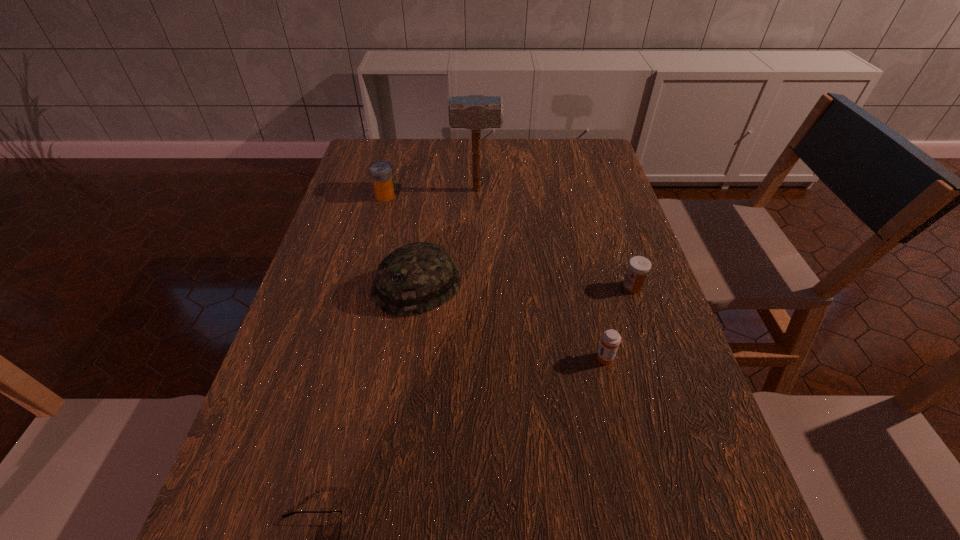
Identify the location of mallet. The width and height of the screenshot is (960, 540). (475, 112).

At what (x,y) coordinates should I click in order to perform the action: click on headwear. Please return your answer as a coordinate pair (x, y). This screenshot has height=540, width=960. Looking at the image, I should click on (417, 277).

The width and height of the screenshot is (960, 540). Find the location of `the leftmost medicine`. the leftmost medicine is located at coordinates (381, 172).

This screenshot has width=960, height=540. In order to click on the tallest medicine in this screenshot , I will do `click(381, 172)`.

You are a GUI agent. You are given a task and a screenshot of the screen. Output one action in this format:
    pyautogui.click(x=<x>, y=<y>)
    Task: Click on the fifth object from left to right
    This screenshot has height=540, width=960.
    Given the screenshot: What is the action you would take?
    pyautogui.click(x=610, y=341)

At what (x,y) coordinates should I click in order to perform the action: click on the second nearest object. Please return your answer as a coordinate pair (x, y). This screenshot has height=540, width=960. Looking at the image, I should click on (610, 341).

The image size is (960, 540). In order to click on the rightmost object in this screenshot , I will do `click(638, 267)`.

Locate an element on the screen. This screenshot has width=960, height=540. the second farthest medicine is located at coordinates (638, 267).

You are a GUI agent. You are given a task and a screenshot of the screen. Output one action in this format:
    pyautogui.click(x=<x>, y=<y>)
    Task: Click on the vacant space located on the striking face of the mallet
    Image resolution: width=960 pixels, height=540 pixels.
    Given the screenshot: What is the action you would take?
    pyautogui.click(x=600, y=190)

Locate an element on the screen. Image resolution: width=960 pixels, height=540 pixels. free location located on the front of the headwear is located at coordinates (398, 415).